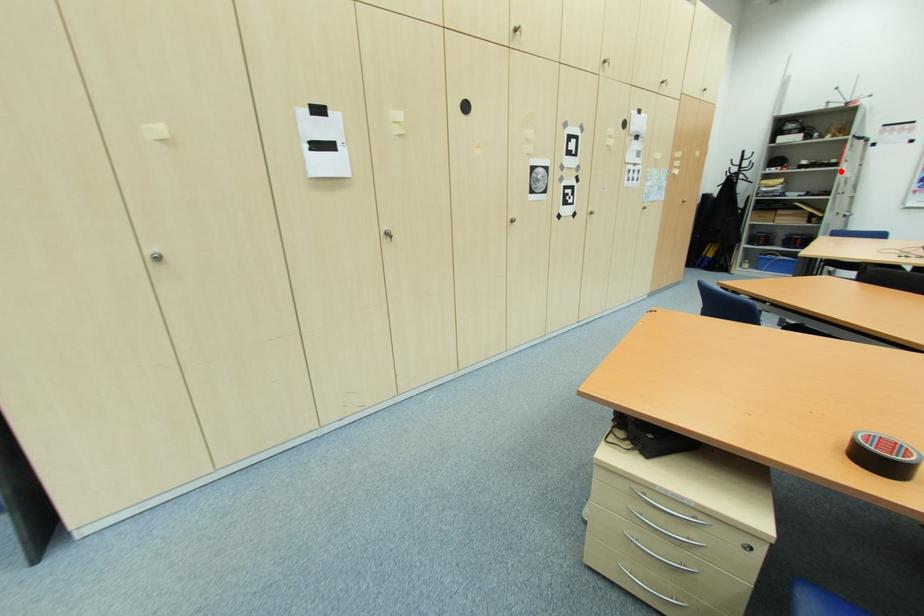
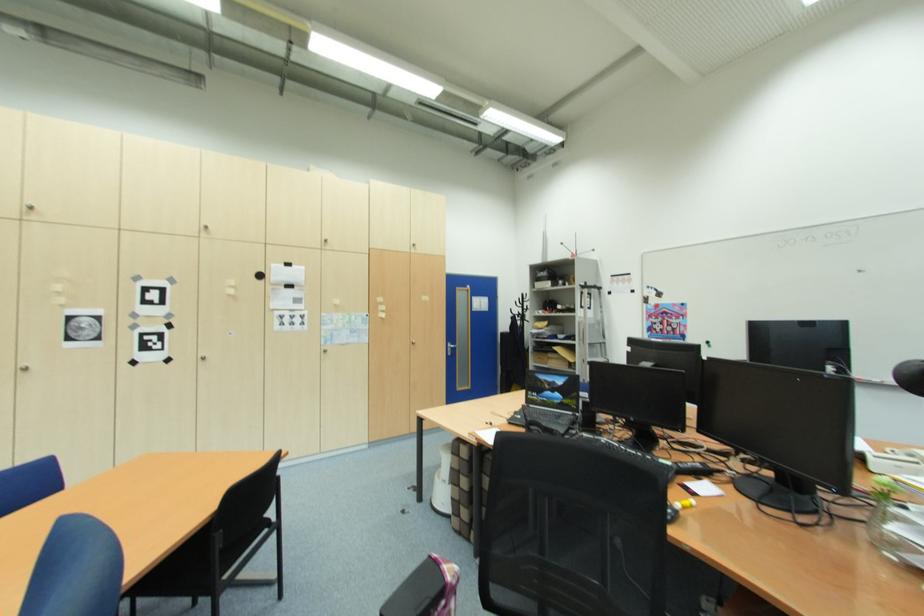
Question: I am providing you with two images of the same scene from different viewpoints. A red point is shown in image1. For the corresponding object point in image2, is it positioned nearer or farther from the camera?

Choices:
 (A) Nearer
 (B) Farther

Answer: (A)